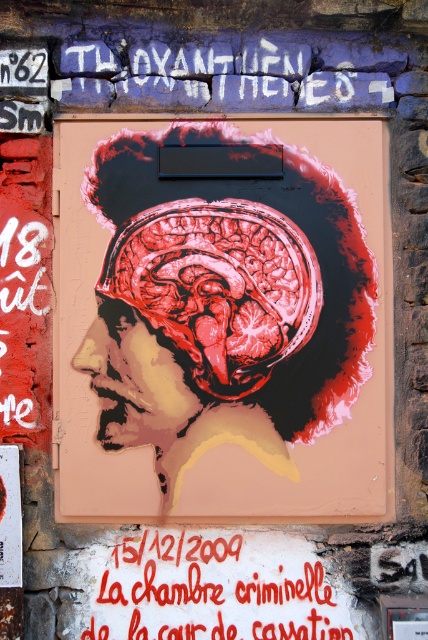
Question: Is matte black anatomical brain at center wider than red painted text at center?

Choices:
 (A) yes
 (B) no

Answer: (A)

Question: Is matte black anatomical brain at center closer to the viewer compared to red painted text at center?

Choices:
 (A) yes
 (B) no

Answer: (B)

Question: Which object is closer to the camera taking this photo?

Choices:
 (A) matte black anatomical brain at center
 (B) red painted text at center

Answer: (B)

Question: Can you confirm if matte black anatomical brain at center is smaller than red painted text at center?

Choices:
 (A) yes
 (B) no

Answer: (B)